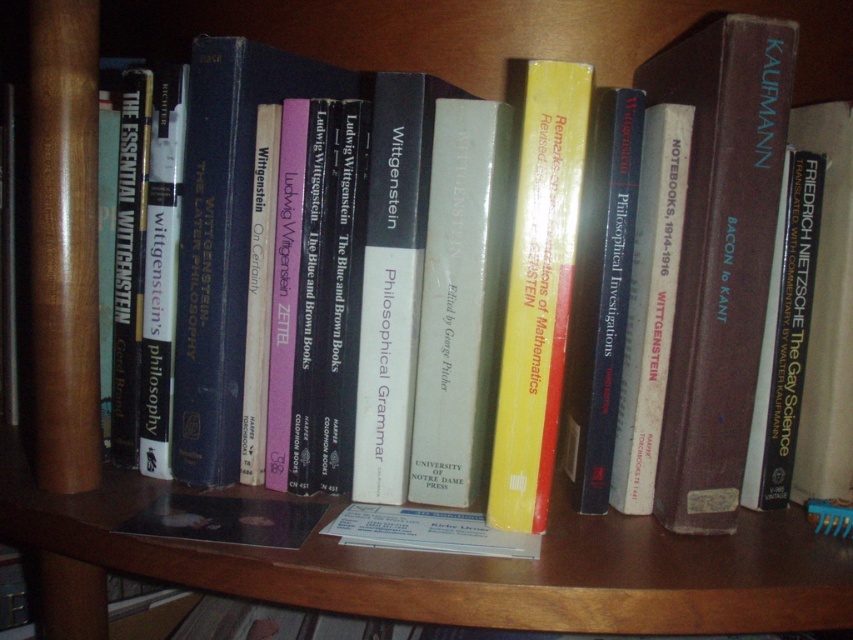
Question: Which point is closer to the camera?

Choices:
 (A) brown leather book at center
 (B) yellow matte book at center

Answer: (B)

Question: Is brown leather book at center wider than yellow matte book at center?

Choices:
 (A) yes
 (B) no

Answer: (A)

Question: Does brown leather book at center have a lesser width compared to yellow matte book at center?

Choices:
 (A) yes
 (B) no

Answer: (B)

Question: Is brown leather book at center bigger than yellow matte book at center?

Choices:
 (A) yes
 (B) no

Answer: (A)